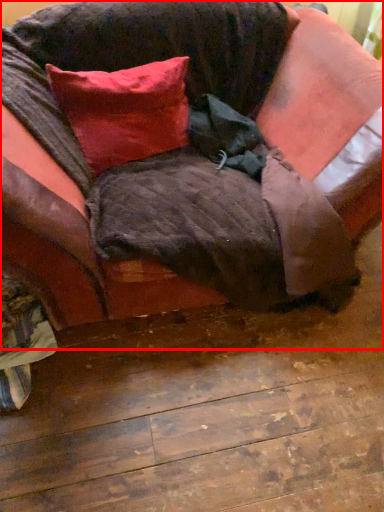
Question: Considering the relative positions of studio couch (annotated by the red box) and pillow in the image provided, where is studio couch (annotated by the red box) located with respect to the staircase?

Choices:
 (A) left
 (B) right

Answer: (B)